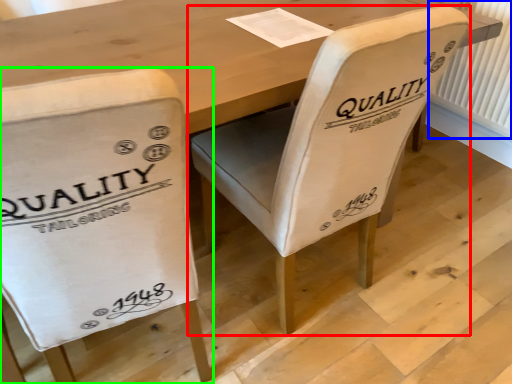
Question: Which is farther away from chair (highlighted by a red box)? radiator (highlighted by a blue box) or chair (highlighted by a green box)?

Choices:
 (A) radiator
 (B) chair

Answer: (A)